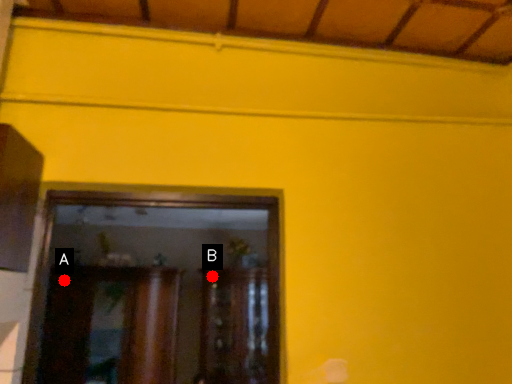
Question: Two points are circled on the image, labeled by A and B beside each circle. Which point appears closest to the camera in this image?

Choices:
 (A) A is closer
 (B) B is closer

Answer: (A)